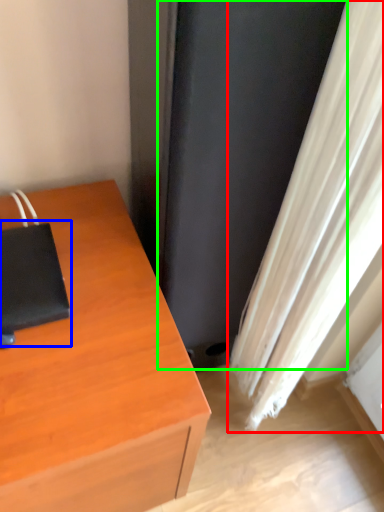
Question: Considering the real-world distances, which object is closest to curtain (highlighted by a red box)? notebook (highlighted by a blue box) or screen door (highlighted by a green box).

Choices:
 (A) notebook
 (B) screen door

Answer: (B)